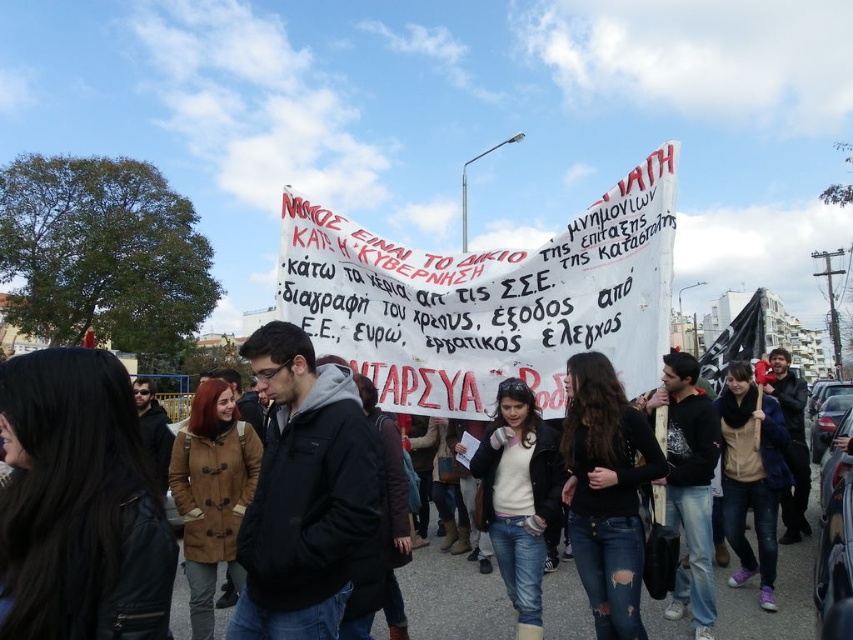
Question: Which point is farther to the camera?

Choices:
 (A) jeans at center
 (B) white paper banner at center

Answer: (B)

Question: Can you confirm if white paper banner at center is smaller than jeans at center?

Choices:
 (A) yes
 (B) no

Answer: (A)

Question: Which point is farther to the camera?

Choices:
 (A) tap(413, 572)
 (B) tap(384, 316)

Answer: (B)

Question: Is white paper banner at center positioned in front of jeans at center?

Choices:
 (A) no
 (B) yes

Answer: (A)

Question: Is white paper banner at center behind jeans at center?

Choices:
 (A) no
 (B) yes

Answer: (B)